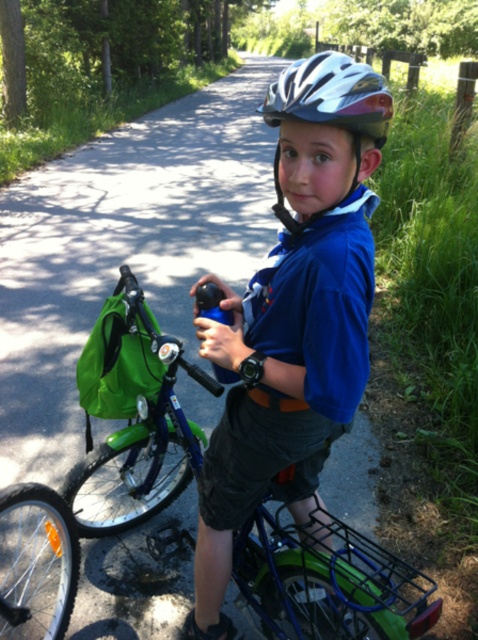
Question: Is blue fabric shirt at center bigger than silver metallic helmet at center?

Choices:
 (A) yes
 (B) no

Answer: (A)

Question: Which object appears closest to the camera in this image?

Choices:
 (A) blue fabric shirt at center
 (B) silver metallic helmet at center

Answer: (A)

Question: Does blue fabric shirt at center have a lesser width compared to silver metallic helmet at center?

Choices:
 (A) no
 (B) yes

Answer: (A)

Question: From the image, what is the correct spatial relationship of blue fabric shirt at center in relation to silver metallic helmet at center?

Choices:
 (A) below
 (B) above

Answer: (A)